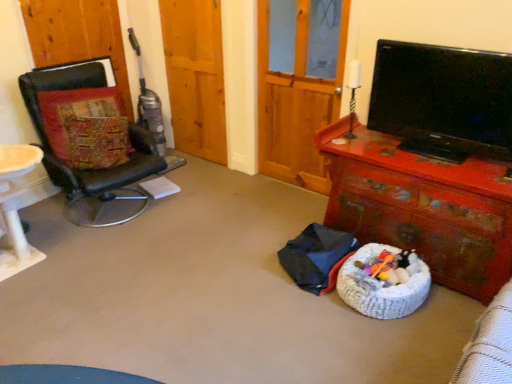
This screenshot has height=384, width=512. Identify the location of vacant area located to the right-hand side of black leather chair at left. (198, 215).